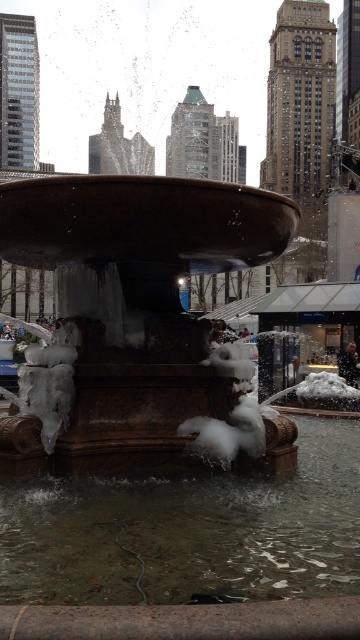
Is bronze stone fountain at center wider than clear water at fountain center?

Incorrect, bronze stone fountain at center's width does not surpass clear water at fountain center's.

Where is `bronze stone fountain at center`? The image size is (360, 640). bronze stone fountain at center is located at coordinates (137, 324).

Identify the location of bronze stone fountain at center. This screenshot has height=640, width=360. (137, 324).